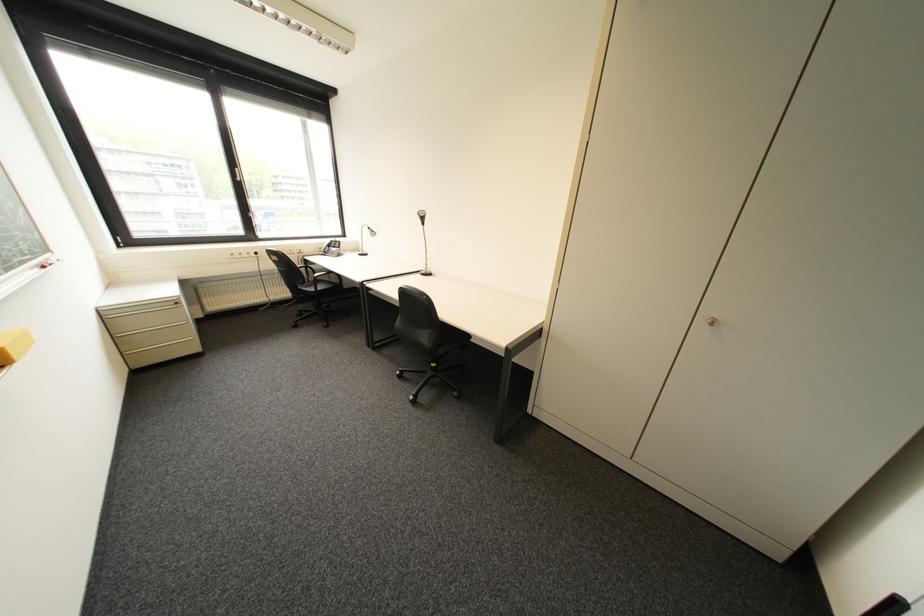
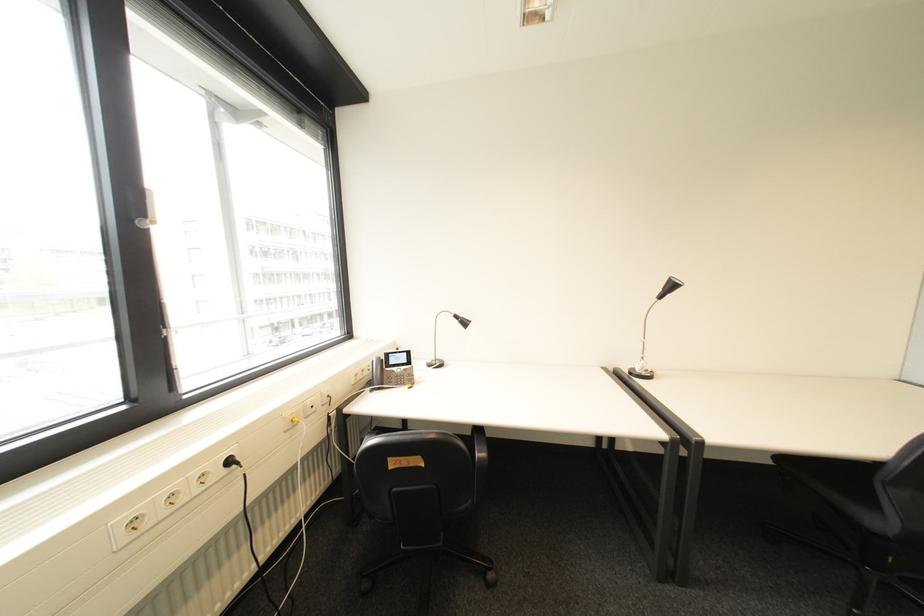
Where in the second image is the point corresponding to [266,254] from the first image?

(239, 463)